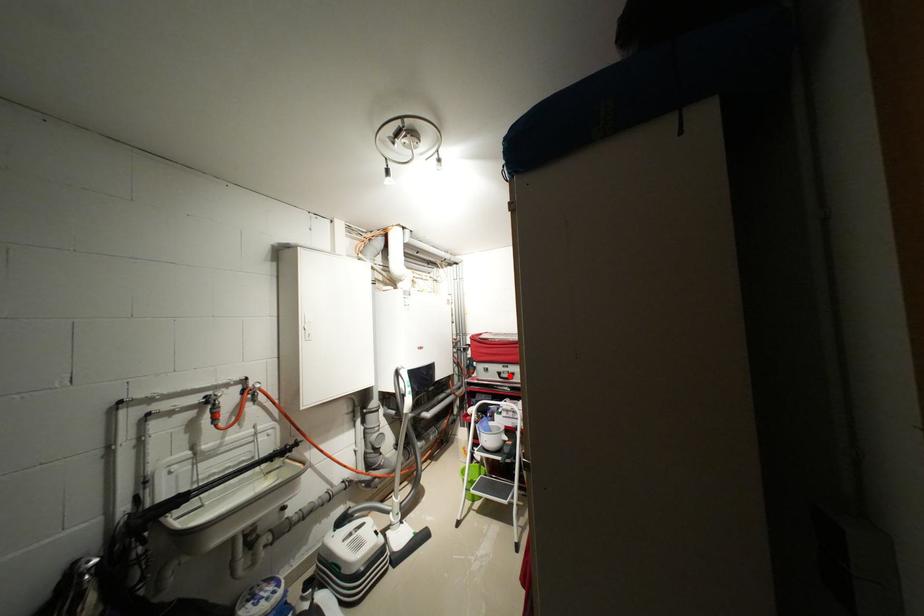
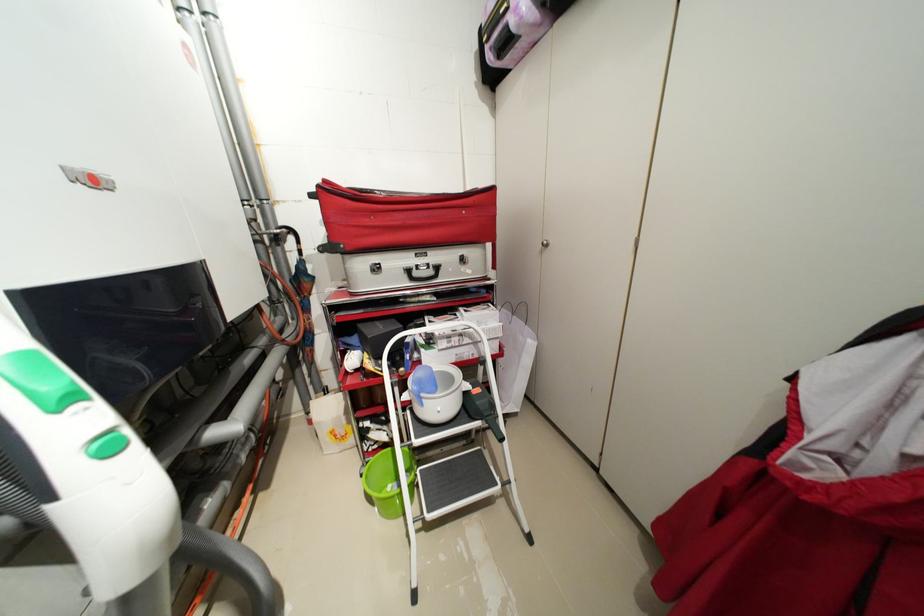
Where in the second image is the point corresponding to the highlighted location from the first image?

(422, 275)